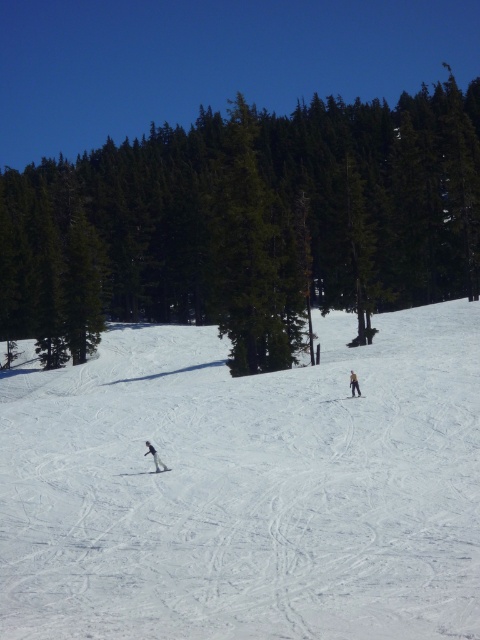
Can you confirm if white snowboarder at lower center is thinner than black matte ski at center?

Yes.

The image size is (480, 640). What are the coordinates of `white snowboarder at lower center` in the screenshot? It's located at (155, 458).

Locate an element on the screen. white snowboarder at lower center is located at coordinates (155, 458).

The image size is (480, 640). What do you see at coordinates (247, 486) in the screenshot? I see `white powdery snow at center` at bounding box center [247, 486].

Is point (29, 419) in front of point (357, 396)?

No.

Where is `white powdery snow at center`? This screenshot has height=640, width=480. white powdery snow at center is located at coordinates (247, 486).

Does yellowish-green fabric jacket at center-right appear under white matte ski at lower left?

Actually, yellowish-green fabric jacket at center-right is above white matte ski at lower left.

Is point (354, 376) farther from camera compared to point (155, 458)?

That is True.

Which is behind, point (356, 381) or point (168, 470)?

Point (356, 381)

Locate an element on the screen. Image resolution: width=480 pixels, height=640 pixels. yellowish-green fabric jacket at center-right is located at coordinates (354, 385).